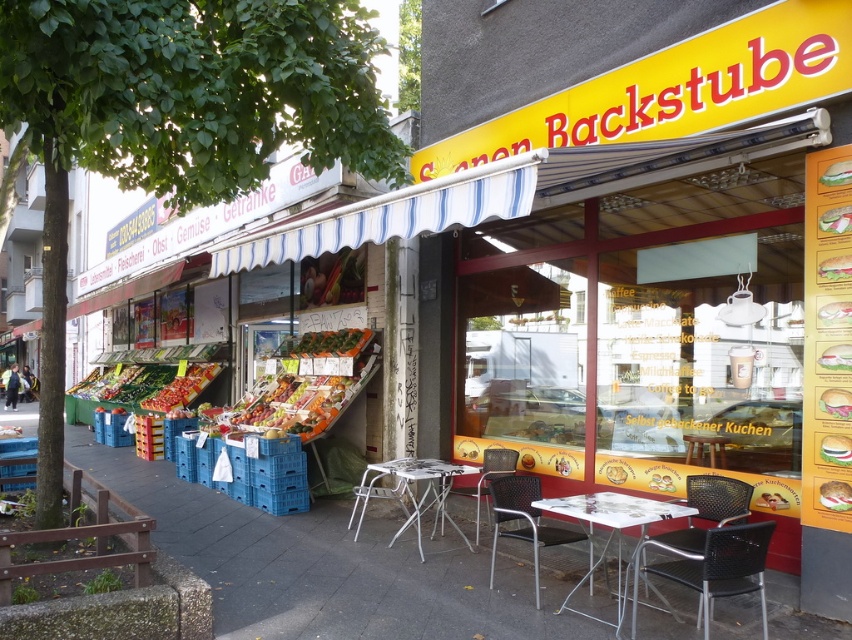
You are a delivery person with a large box that is 2 meters wide. You need to place it on the smooth concrete pavement at center or the white plastic table at center. Which surface can accommodate the box without it hanging off the edge?

The smooth concrete pavement at center is wider than the white plastic table at center, so the box should be placed on the smooth concrete pavement at center.